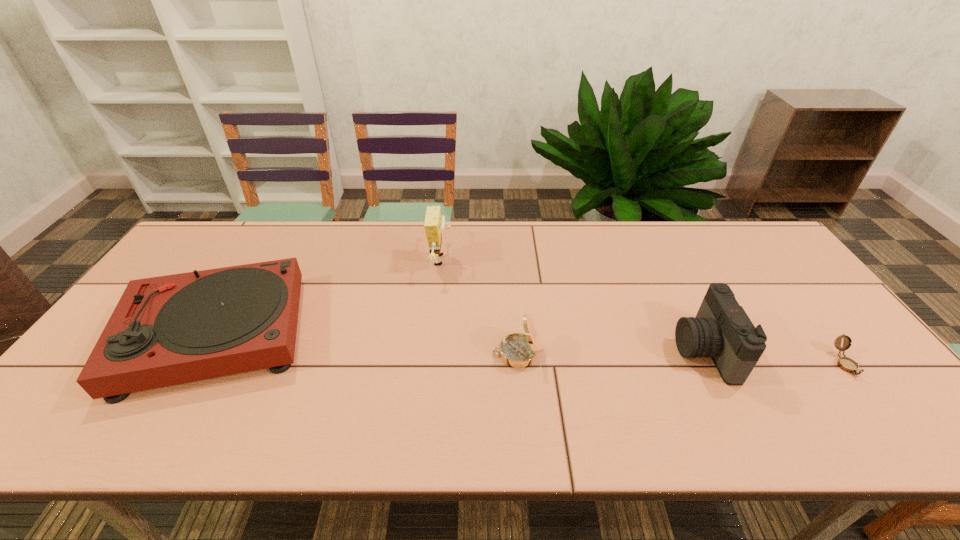
Where is `free space located at the lens of the camera`? This screenshot has height=540, width=960. free space located at the lens of the camera is located at coordinates (614, 350).

I want to click on free spot located at the lens of the camera, so click(594, 350).

Find the location of a particular element. Image resolution: width=960 pixels, height=540 pixels. blank space located 0.200m at the lens of the camera is located at coordinates (599, 350).

The image size is (960, 540). I want to click on vacant space situated 0.370m on the right of the leftmost object, so click(x=450, y=334).

You are a GUI agent. You are given a task and a screenshot of the screen. Output one action in this format:
    pyautogui.click(x=<x>, y=<y>)
    Task: Click on the blank area located with the dial facing the left compass
    
    Given the screenshot: What is the action you would take?
    pos(472,353)

At what (x,y) coordinates should I click in order to perform the action: click on vacant space positioned with the dial facing the left compass. Please return your answer as a coordinate pair (x, y). Looking at the image, I should click on (353, 353).

Find the location of `free space located 0.090m with the dial facing the left compass`. free space located 0.090m with the dial facing the left compass is located at coordinates click(x=456, y=353).

Where is `vacant point located on the face of the shorter compass`? This screenshot has width=960, height=540. vacant point located on the face of the shorter compass is located at coordinates (903, 439).

This screenshot has width=960, height=540. What are the coordinates of `object present at the far edge` in the screenshot? It's located at (434, 224).

Locate an element on the screen. object present at the left edge is located at coordinates (167, 330).